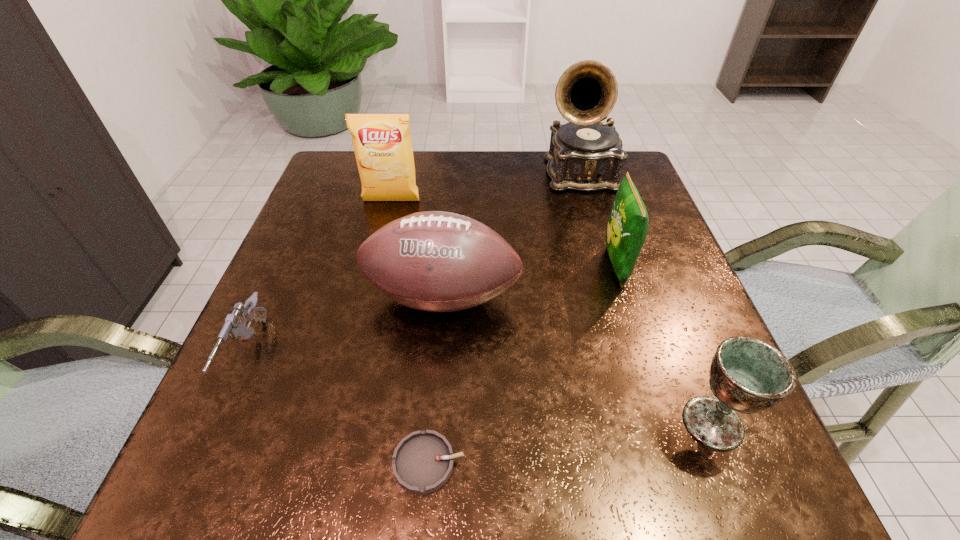
Locate an element on the screen. This screenshot has width=960, height=540. vacant space that satisfies the following two spatial constraints: 1. on the horn of the tallest object; 2. on the left side of the chalice is located at coordinates (651, 423).